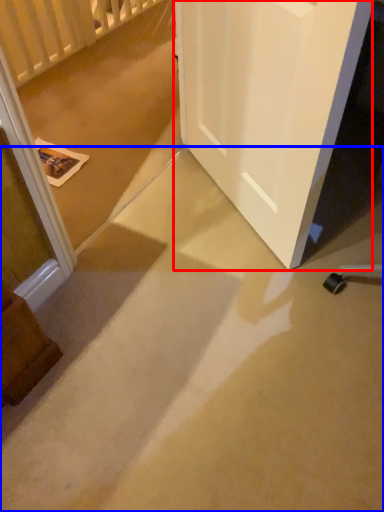
Question: Among these objects, which one is farthest to the camera, door (highlighted by a red box) or concrete (highlighted by a blue box)?

Choices:
 (A) door
 (B) concrete

Answer: (A)